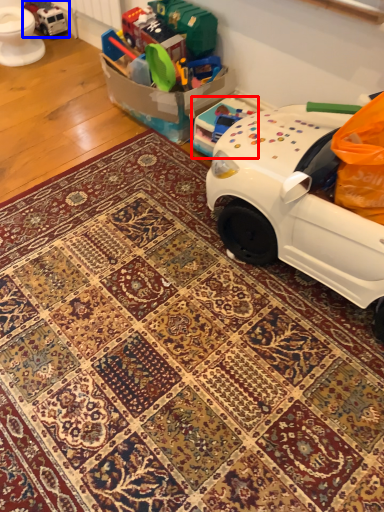
Question: Which object appears farthest to the camera in this image, toy (highlighted by a red box) or toy (highlighted by a blue box)?

Choices:
 (A) toy
 (B) toy

Answer: (B)